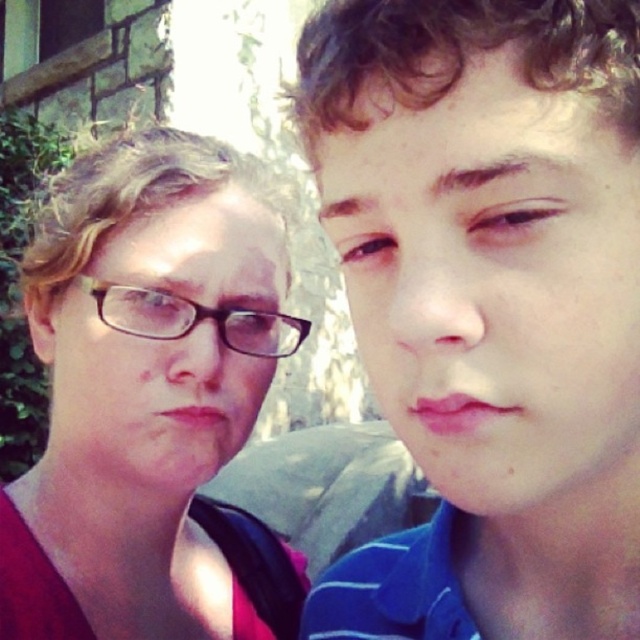
Is smooth skin face at upper right wider than black plastic glasses at upper left?

No, smooth skin face at upper right is not wider than black plastic glasses at upper left.

Who is lower down, smooth skin face at upper right or black plastic glasses at upper left?

smooth skin face at upper right is below.

Which is behind, point (419, 316) or point (244, 336)?

Positioned behind is point (244, 336).

Locate an element on the screen. The image size is (640, 640). smooth skin face at upper right is located at coordinates (497, 288).

Who is shorter, smooth skin face at upper right or matte black glasses at left?

smooth skin face at upper right is shorter.

Is point (368, 280) in front of point (200, 257)?

Yes, it is in front of point (200, 257).

Is point (573, 122) positioned in front of point (173, 474)?

Yes, it is.

Locate an element on the screen. The height and width of the screenshot is (640, 640). smooth skin face at upper right is located at coordinates (497, 288).

Between point (141, 134) and point (97, 344), which one is positioned in front?

Point (97, 344) is more forward.

Does matte black glasses at upper left have a greater width compared to matte black glasses at left?

Correct, the width of matte black glasses at upper left exceeds that of matte black glasses at left.

At what (x,y) coordinates should I click in order to perform the action: click on matte black glasses at upper left. Please return your answer as a coordinate pair (x, y). This screenshot has width=640, height=640. Looking at the image, I should click on (150, 400).

Find the location of a particular element. This screenshot has width=640, height=640. matte black glasses at upper left is located at coordinates (150, 400).